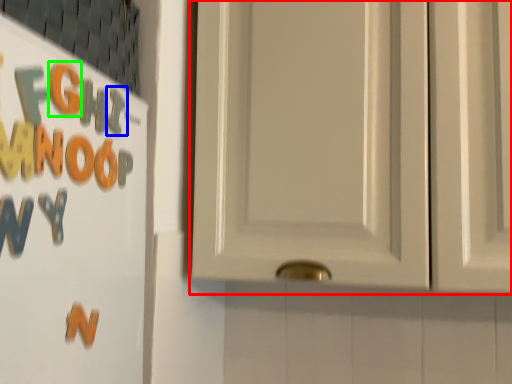
Question: Which object is positioned farthest from door (highlighted by a red box)? Select from letter (highlighted by a blue box) and letter (highlighted by a green box).

Choices:
 (A) letter
 (B) letter

Answer: (B)